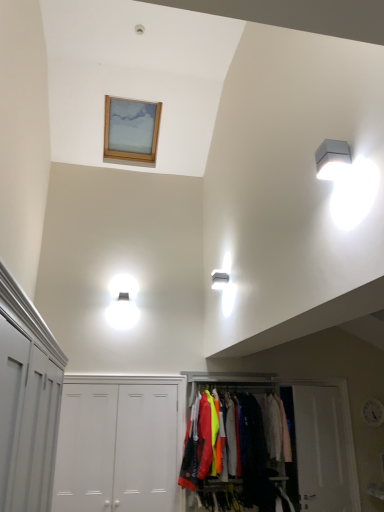
Locate an element on the screen. The image size is (384, 512). white matte door at center, which is the 3th door from right to left is located at coordinates (120, 444).

Identify the location of white matte door at center, the 4th door in the right-to-left sequence. This screenshot has width=384, height=512. (86, 448).

Can we say white matte door at lower right, placed as the 1th door when sorted from right to left, lies outside wooden picture frame at upper center?

Yes, white matte door at lower right, placed as the 1th door when sorted from right to left, is located beyond the bounds of wooden picture frame at upper center.

Is white matte door at lower right, the fourth door when ordered from left to right, shorter than wooden picture frame at upper center?

No.

Image resolution: width=384 pixels, height=512 pixels. I want to click on the 3rd door to the right of the wooden picture frame at upper center, counting from the anchor's position, so click(x=321, y=449).

Considering the positions of objects matte fabric clothes rack at center and white matte door at center, which ranks as the first door in left-to-right order, in the image provided, who is behind, matte fabric clothes rack at center or white matte door at center, which ranks as the first door in left-to-right order,?

white matte door at center, which ranks as the first door in left-to-right order, is further away from the camera.

Is matte fabric clothes rack at center outside of white matte door at center, the 4th door in the right-to-left sequence?

Indeed, matte fabric clothes rack at center is completely outside white matte door at center, the 4th door in the right-to-left sequence.

Is matte fabric clothes rack at center not near white matte door at center, which ranks as the first door in left-to-right order?

Yes, matte fabric clothes rack at center and white matte door at center, which ranks as the first door in left-to-right order, are quite far apart.

From a real-world perspective, is matte fabric clothes rack at center below white matte door at center, the 4th door in the right-to-left sequence?

Yes.

From the image's perspective, is white matte door at center, which is the 3th door from right to left, under white matte door at center, arranged as the third door when viewed from the left?

Incorrect, from the image's perspective, white matte door at center, which is the 3th door from right to left, is higher than white matte door at center, arranged as the third door when viewed from the left.

Considering the positions of objects white matte door at center, which is the second door in left-to-right order, and white matte door at center, arranged as the third door when viewed from the left, in the image provided, who is in front, white matte door at center, which is the second door in left-to-right order, or white matte door at center, arranged as the third door when viewed from the left,?

white matte door at center, which is the second door in left-to-right order.

Can you confirm if white matte door at center, which is the 3th door from right to left, is shorter than white matte door at center, arranged as the third door when viewed from the left?

Incorrect, the height of white matte door at center, which is the 3th door from right to left, does not fall short of that of white matte door at center, arranged as the third door when viewed from the left.

Is point (153, 400) in front of point (150, 440)?

No, it is behind (150, 440).

Which object is positioned more to the right, wooden picture frame at upper center or light pink fabric at center?

light pink fabric at center.

From a real-world perspective, who is located higher, wooden picture frame at upper center or light pink fabric at center?

wooden picture frame at upper center.

Considering the sizes of objects wooden picture frame at upper center and light pink fabric at center in the image provided, who is smaller, wooden picture frame at upper center or light pink fabric at center?

With smaller size is light pink fabric at center.

From the image's perspective, relative to white plastic light fixture at upper right, is white painted wood cabinet at left above or below?

white painted wood cabinet at left is situated lower than white plastic light fixture at upper right in the image.

Is white painted wood cabinet at left oriented towards white plastic light fixture at upper right?

No, white painted wood cabinet at left does not turn towards white plastic light fixture at upper right.

Considering their positions, is white matte door at center, the 4th door in the right-to-left sequence, located in front of or behind white painted wood cabinet at left?

white matte door at center, the 4th door in the right-to-left sequence, is behind white painted wood cabinet at left.

Is white matte door at center, which ranks as the first door in left-to-right order, far from white painted wood cabinet at left?

white matte door at center, which ranks as the first door in left-to-right order, is far away from white painted wood cabinet at left.

From the image's perspective, would you say white matte door at center, the 4th door in the right-to-left sequence, is shown under white painted wood cabinet at left?

Yes, from the image's perspective, white matte door at center, the 4th door in the right-to-left sequence, is below white painted wood cabinet at left.

Does point (65, 394) come behind point (21, 352)?

Yes, point (65, 394) is behind point (21, 352).

From the picture: Would you say white matte door at center, which is the 3th door from right to left, is outside white plastic light fixture at upper right?

Yes, white matte door at center, which is the 3th door from right to left, is not within white plastic light fixture at upper right.

Is white matte door at center, which is the second door in left-to-right order, turned away from white plastic light fixture at upper right?

No, white matte door at center, which is the second door in left-to-right order,'s orientation is not away from white plastic light fixture at upper right.

Which is more to the right, white matte door at center, which is the 3th door from right to left, or white plastic light fixture at upper right?

white plastic light fixture at upper right.

Is point (98, 389) in front of point (336, 141)?

That is False.

The width and height of the screenshot is (384, 512). Identify the location of picture frame above the white matte door at lower right, placed as the 1th door when sorted from right to left (from a real-world perspective). (131, 129).

Image resolution: width=384 pixels, height=512 pixels. What are the coordinates of `the 3rd door to the left of the matte fabric clothes rack at center, starting your count from the anchor` in the screenshot? It's located at (86, 448).

Looking at the image, which one is located closer to white matte door at center, the 4th door in the right-to-left sequence, white plastic light fixture at upper right or white painted wood cabinet at left?

Based on the image, white painted wood cabinet at left appears to be nearer to white matte door at center, the 4th door in the right-to-left sequence.

Based on their spatial positions, is light pink fabric at center or white matte door at center, arranged as the third door when viewed from the left, closer to white painted wood cabinet at left?

The object closer to white painted wood cabinet at left is white matte door at center, arranged as the third door when viewed from the left.

Estimate the real-world distances between objects in this image. Which object is closer to matte fabric clothes rack at center, white matte door at center, arranged as the third door when viewed from the left, or white matte door at lower right, the fourth door when ordered from left to right?

Among the two, white matte door at lower right, the fourth door when ordered from left to right, is located nearer to matte fabric clothes rack at center.

Looking at the image, which one is located further to white matte door at center, which ranks as the first door in left-to-right order, wooden picture frame at upper center or white painted wood cabinet at left?

The object further to white matte door at center, which ranks as the first door in left-to-right order, is wooden picture frame at upper center.

Consider the image. Based on their spatial positions, is white plastic light fixture at upper right or white matte door at center, the 4th door in the right-to-left sequence, closer to white matte door at lower right, the fourth door when ordered from left to right?

Based on the image, white matte door at center, the 4th door in the right-to-left sequence, appears to be nearer to white matte door at lower right, the fourth door when ordered from left to right.

Looking at the image, which one is located closer to white matte door at center, which is the 3th door from right to left, white painted wood cabinet at left or matte fabric clothes rack at center?

Among the two, matte fabric clothes rack at center is located nearer to white matte door at center, which is the 3th door from right to left.

Based on the photo, based on their spatial positions, is wooden picture frame at upper center or light pink fabric at center further from white matte door at center, which is the second door in left-to-right order?

wooden picture frame at upper center is further to white matte door at center, which is the second door in left-to-right order.

When comparing their distances from white matte door at center, which is the second door in left-to-right order, does white painted wood cabinet at left or light pink fabric at center seem closer?

Based on the image, light pink fabric at center appears to be nearer to white matte door at center, which is the second door in left-to-right order.

This screenshot has width=384, height=512. In order to click on dresser situated between white matte door at center, the 4th door in the right-to-left sequence, and white matte door at lower right, the fourth door when ordered from left to right, from left to right in this screenshot , I will do `click(230, 449)`.

Locate an element on the screen. clothing between matte fabric clothes rack at center and white matte door at lower right, the fourth door when ordered from left to right, from left to right is located at coordinates (276, 428).

At what (x,y) coordinates should I click in order to perform the action: click on dresser positioned between white painted wood cabinet at left and white matte door at center, which is the second door in left-to-right order, from near to far. Please return your answer as a coordinate pair (x, y). Looking at the image, I should click on (230, 449).

At what (x,y) coordinates should I click in order to perform the action: click on door between white painted wood cabinet at left and white matte door at center, which ranks as the first door in left-to-right order, from front to back. Please return your answer as a coordinate pair (x, y). The image size is (384, 512). Looking at the image, I should click on (120, 444).